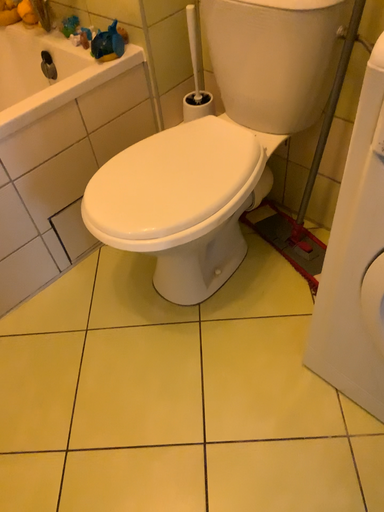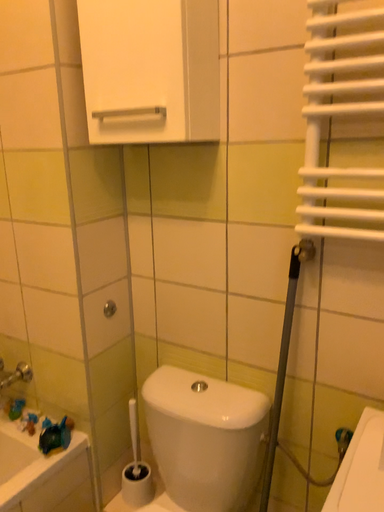
Question: Which way did the camera rotate in the video?

Choices:
 (A) rotated downward
 (B) rotated upward

Answer: (B)